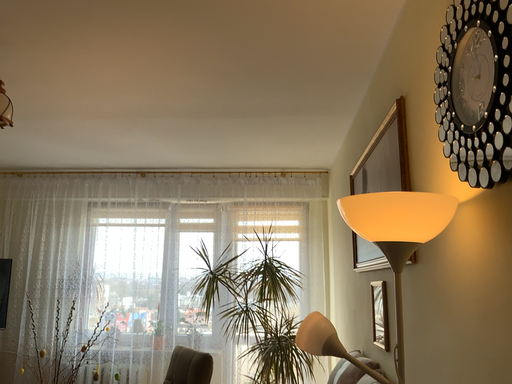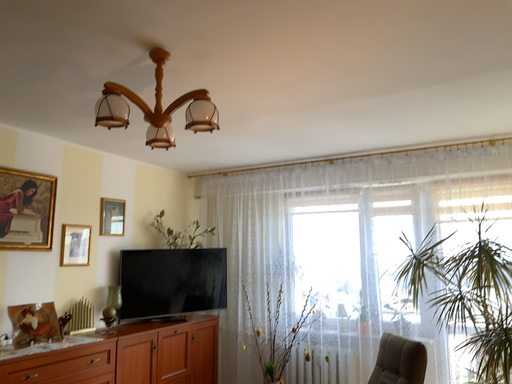
Question: Which way did the camera rotate in the video?

Choices:
 (A) rotated right
 (B) rotated left

Answer: (B)